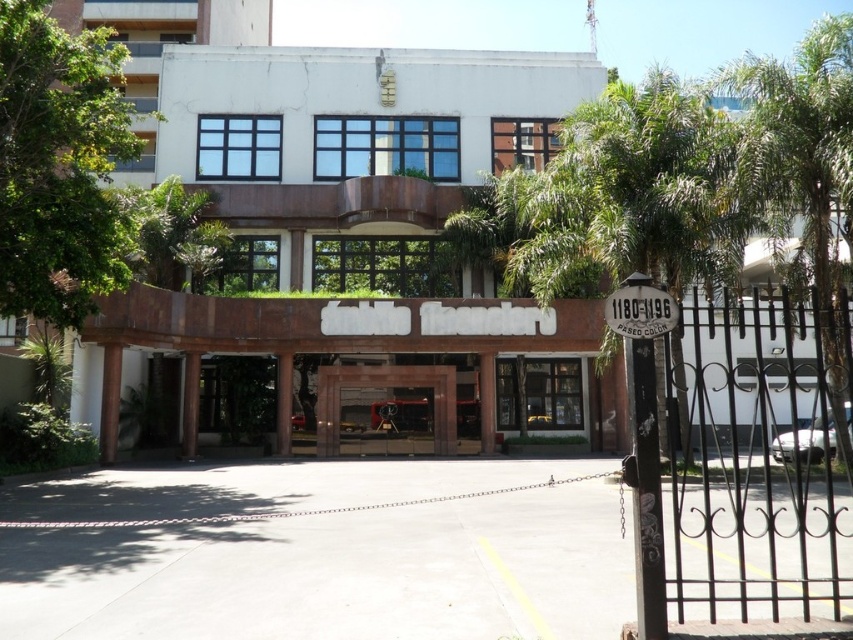
Question: Which of the following is the farthest from the observer?

Choices:
 (A) (42, 225)
 (B) (155, 52)

Answer: (B)

Question: Based on their relative distances, which object is farther from the clear glass window at upper center?

Choices:
 (A) brown stone gate at center
 (B) green leafy palm tree at right
 (C) clear glass door at center

Answer: (B)

Question: Is green leafy tree at left bigger than clear glass door at center?

Choices:
 (A) yes
 (B) no

Answer: (A)

Question: Can you confirm if green leafy palm tree at right is positioned to the right of clear glass door at center?

Choices:
 (A) yes
 (B) no

Answer: (A)

Question: Is clear glass window at upper center behind brown stone gate at center?

Choices:
 (A) yes
 (B) no

Answer: (A)

Question: Which object appears closest to the camera in this image?

Choices:
 (A) clear glass door at center
 (B) green leafy tree at left
 (C) green leafy palm tree at right

Answer: (C)